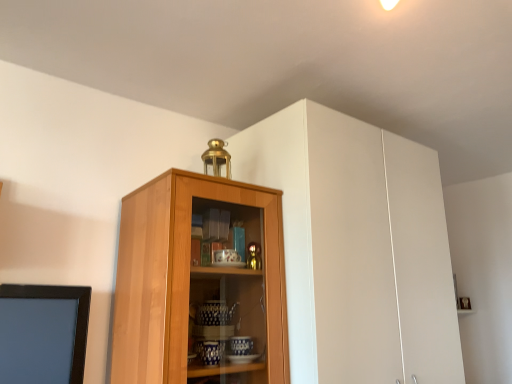
Question: From a real-world perspective, is light brown wood cabinet at center positioned above or below white matte cabinet at upper center?

Choices:
 (A) below
 (B) above

Answer: (A)

Question: From the image's perspective, is light brown wood cabinet at center positioned above or below white matte cabinet at upper center?

Choices:
 (A) below
 (B) above

Answer: (A)

Question: In the image, is light brown wood cabinet at center on the left side or the right side of white matte cabinet at upper center?

Choices:
 (A) left
 (B) right

Answer: (A)

Question: Considering the positions of white matte cabinet at upper center and light brown wood cabinet at center in the image, is white matte cabinet at upper center wider or thinner than light brown wood cabinet at center?

Choices:
 (A) wide
 (B) thin

Answer: (A)

Question: From a real-world perspective, relative to light brown wood cabinet at center, is white matte cabinet at upper center vertically above or below?

Choices:
 (A) above
 (B) below

Answer: (A)

Question: Would you say white matte cabinet at upper center is inside or outside light brown wood cabinet at center?

Choices:
 (A) inside
 (B) outside

Answer: (B)

Question: Looking at the image, does white matte cabinet at upper center seem bigger or smaller compared to light brown wood cabinet at center?

Choices:
 (A) small
 (B) big

Answer: (B)